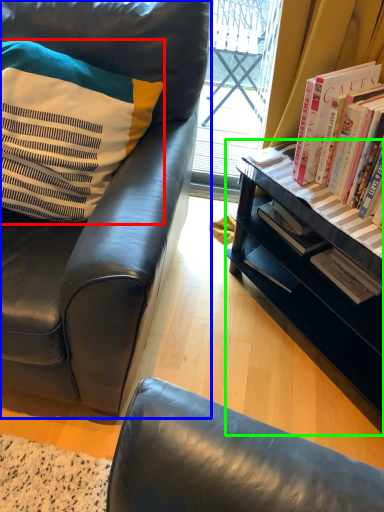
Question: Estimate the real-world distances between objects in this image. Which object is closer to pillow (highlighted by a red box), chair (highlighted by a blue box) or desk (highlighted by a green box)?

Choices:
 (A) chair
 (B) desk

Answer: (A)